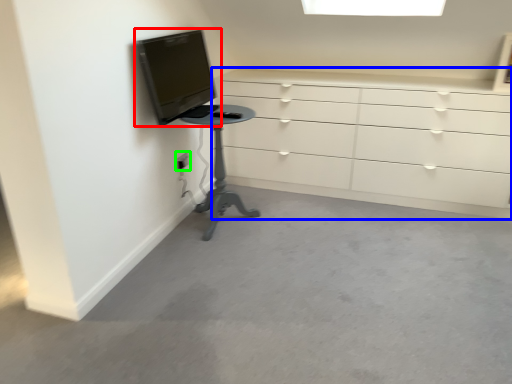
Question: Estimate the real-world distances between objects in this image. Which object is farther from television (highlighted by a red box), chest of drawers (highlighted by a blue box) or electric outlet (highlighted by a green box)?

Choices:
 (A) chest of drawers
 (B) electric outlet

Answer: (A)